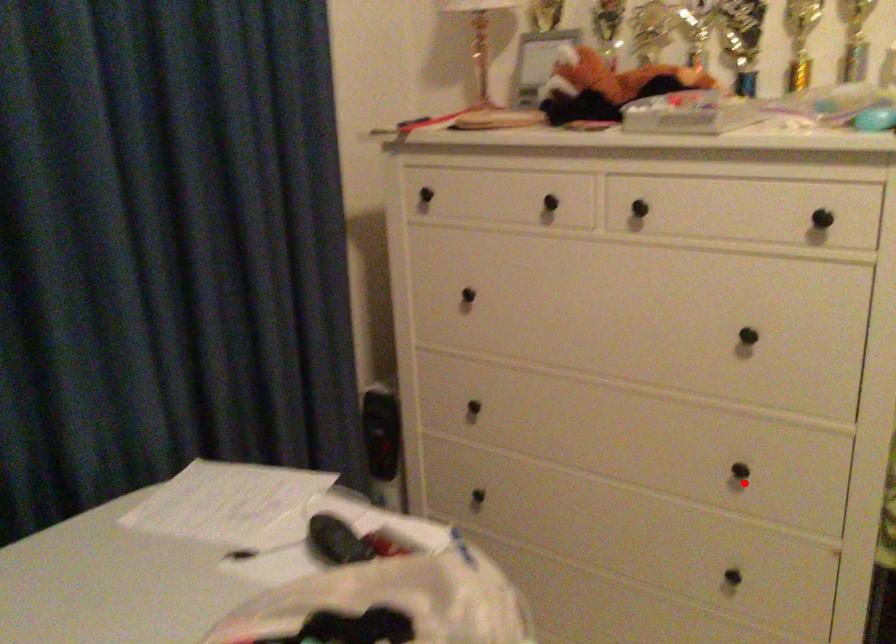
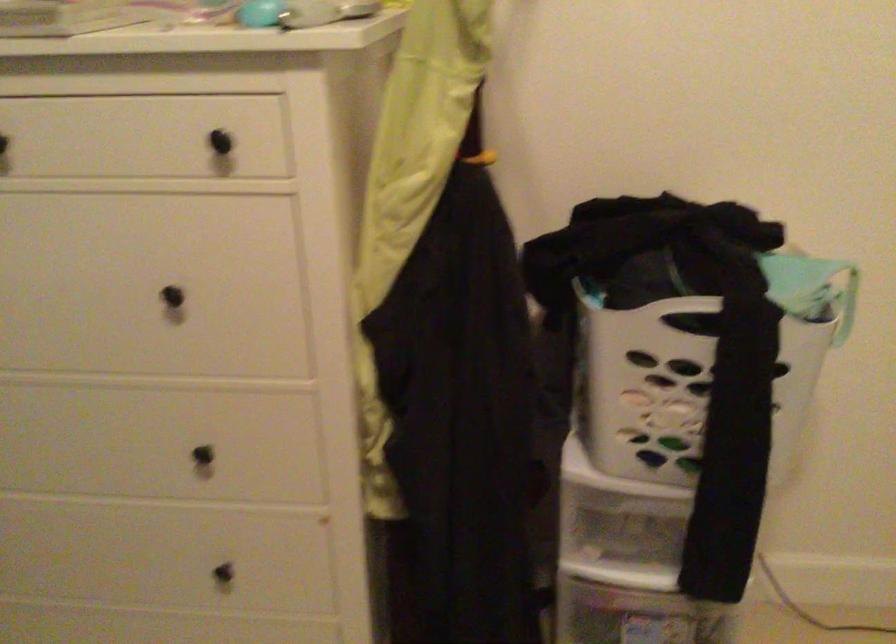
Find the pixel in the second image that matches the highlighted location in the first image.

(213, 462)